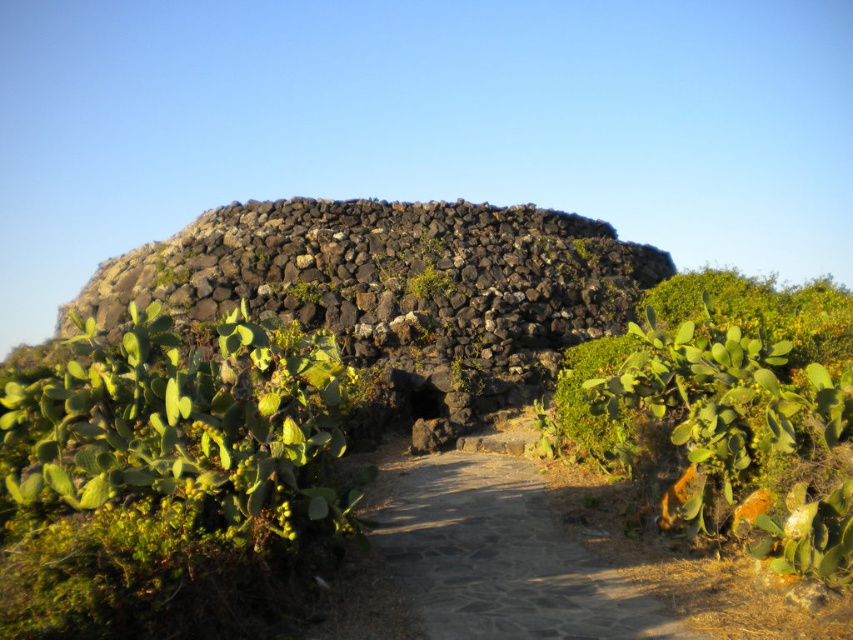
Question: Does green succulent at lower left have a greater width compared to pebble stone path at center?

Choices:
 (A) no
 (B) yes

Answer: (B)

Question: Can you confirm if green succulent at lower left is positioned above volcanic rock at center?

Choices:
 (A) yes
 (B) no

Answer: (B)

Question: Which point is closer to the camera?

Choices:
 (A) (437, 276)
 (B) (154, 390)

Answer: (B)

Question: Can you confirm if green succulent at lower left is smaller than green mossy plant at center?

Choices:
 (A) no
 (B) yes

Answer: (A)

Question: Which point is farther to the camera?

Choices:
 (A) volcanic rock at center
 (B) green mossy plant at center

Answer: (B)

Question: Among these objects, which one is nearest to the camera?

Choices:
 (A) volcanic rock at center
 (B) green succulent at lower left
 (C) green mossy plant at center
 (D) pebble stone path at center

Answer: (B)